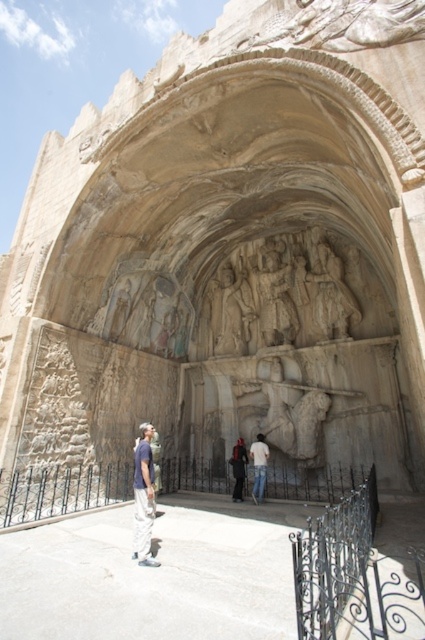
Question: Is light blue denim jeans at lower left to the left of white cotton shirt at center from the viewer's perspective?

Choices:
 (A) no
 (B) yes

Answer: (B)

Question: Which of the following is the closest to the observer?

Choices:
 (A) white cotton shirt at center
 (B) light blue denim jeans at lower left
 (C) dark blue jeans at center

Answer: (B)

Question: Among these objects, which one is farthest from the camera?

Choices:
 (A) light blue denim jeans at lower left
 (B) white cotton shirt at center
 (C) dark blue jeans at center

Answer: (C)

Question: Among these points, which one is farthest from the camera?

Choices:
 (A) (142, 502)
 (B) (260, 499)
 (C) (251, 300)

Answer: (C)

Question: Is carved stone figures at center closer to camera compared to white cotton shirt at center?

Choices:
 (A) no
 (B) yes

Answer: (A)

Question: Observing the image, what is the correct spatial positioning of light blue denim jeans at lower left in reference to white cotton shirt at center?

Choices:
 (A) below
 (B) above

Answer: (B)